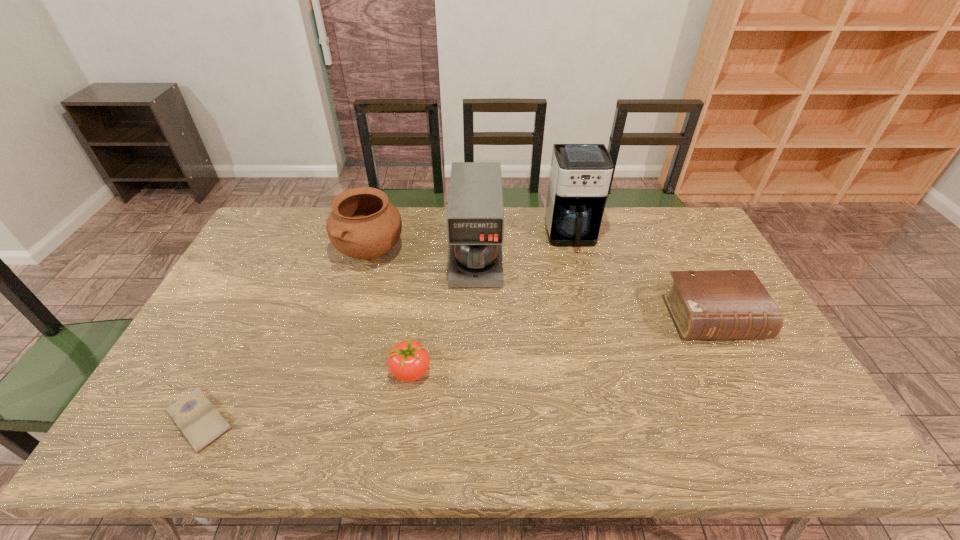
Where is `the nearest object`? The height and width of the screenshot is (540, 960). the nearest object is located at coordinates (201, 423).

The height and width of the screenshot is (540, 960). In order to click on the shortest object in this screenshot , I will do `click(201, 423)`.

The height and width of the screenshot is (540, 960). In order to click on free space located on the front panel of the taller coffee maker in this screenshot , I will do `click(596, 336)`.

Where is `free location located 0.060m on the carafe side of the shorter coffee maker`? This screenshot has width=960, height=540. free location located 0.060m on the carafe side of the shorter coffee maker is located at coordinates (476, 304).

The width and height of the screenshot is (960, 540). I want to click on vacant position located on the right of the pottery, so click(x=485, y=251).

Find the location of a particular element. The height and width of the screenshot is (540, 960). vacant area situated 0.050m on the spine side of the Bible is located at coordinates (734, 360).

Image resolution: width=960 pixels, height=540 pixels. Find the location of `vacant position located on the left of the tomato`. vacant position located on the left of the tomato is located at coordinates (261, 372).

Identify the location of free spot located 0.380m on the back of the diary. (268, 285).

At what (x,y) coordinates should I click in order to perform the action: click on pottery at the far edge. Please return your answer as a coordinate pair (x, y). The image size is (960, 540). Looking at the image, I should click on (363, 224).

The width and height of the screenshot is (960, 540). I want to click on object positioned at the near edge, so click(x=201, y=423).